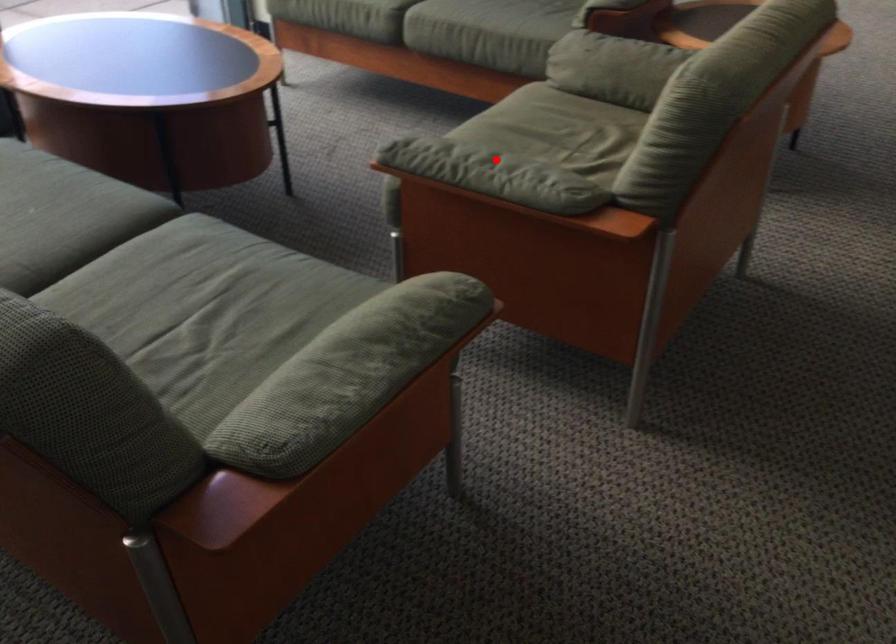
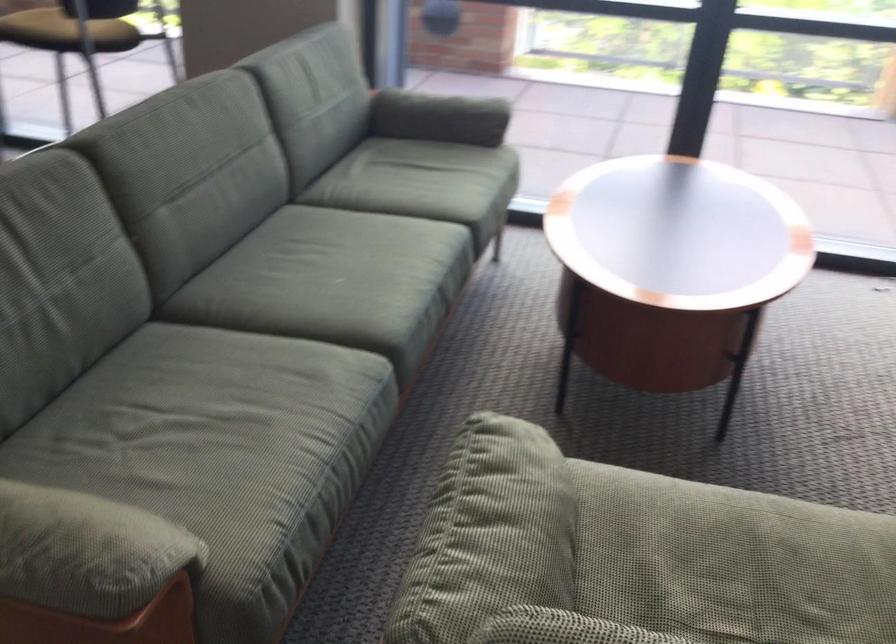
Question: I am providing you with two images of the same scene from different viewpoints. Image1 has a red point marked. In image2, the corresponding 3D location appears at what relative position? Reply with the corresponding letter.

Choices:
 (A) Closer
 (B) Farther

Answer: (A)